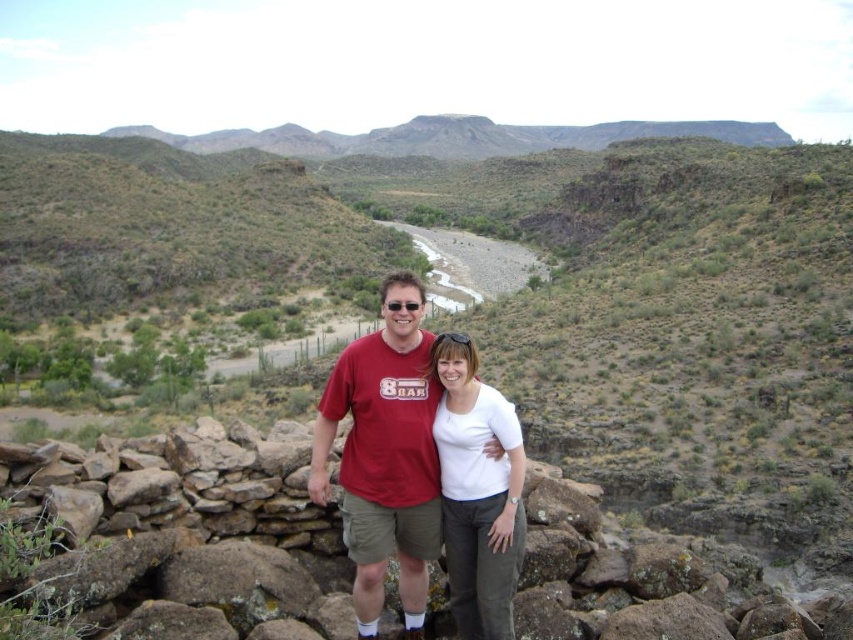
Which is below, brown rough stone wall at center or rugged brown rock formation at upper center?

Positioned lower is brown rough stone wall at center.

Does brown rough stone wall at center have a larger size compared to rugged brown rock formation at upper center?

No.

Describe the element at coordinates (189, 536) in the screenshot. I see `brown rough stone wall at center` at that location.

Where is `brown rough stone wall at center`? The width and height of the screenshot is (853, 640). brown rough stone wall at center is located at coordinates (189, 536).

Can you confirm if brown rough stone wall at center is bigger than matte red t-shirt at center?

Yes.

Is brown rough stone wall at center taller than matte red t-shirt at center?

In fact, brown rough stone wall at center may be shorter than matte red t-shirt at center.

Find the location of a particular element. This screenshot has height=640, width=853. brown rough stone wall at center is located at coordinates (189, 536).

Find the location of a particular element. This screenshot has height=640, width=853. matte red t-shirt at center is located at coordinates (386, 456).

Is point (364, 340) positioned before point (752, 124)?

Yes, it is.

Between point (386, 467) and point (550, 131), which one is positioned behind?

Positioned behind is point (550, 131).

Where is `matte red t-shirt at center`? This screenshot has height=640, width=853. matte red t-shirt at center is located at coordinates (386, 456).